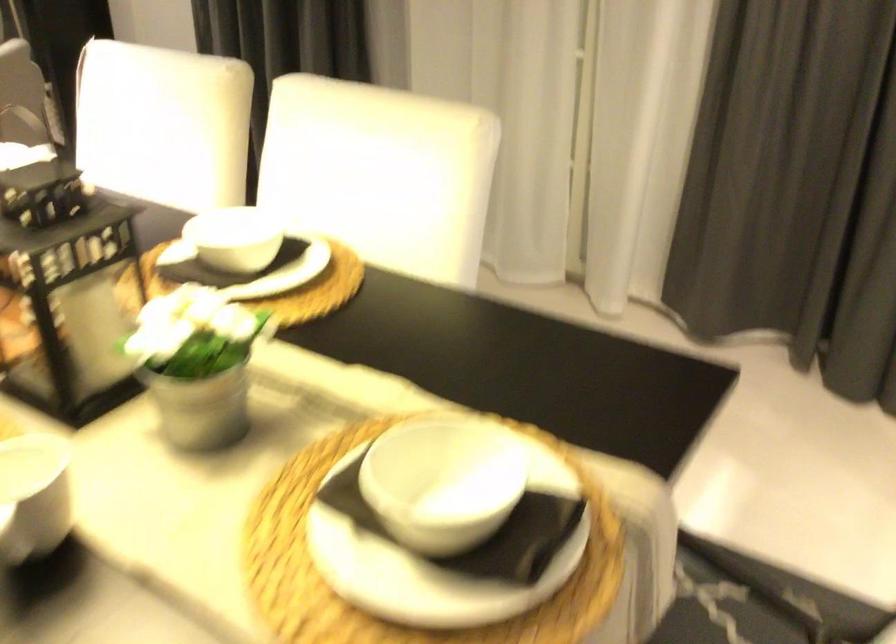
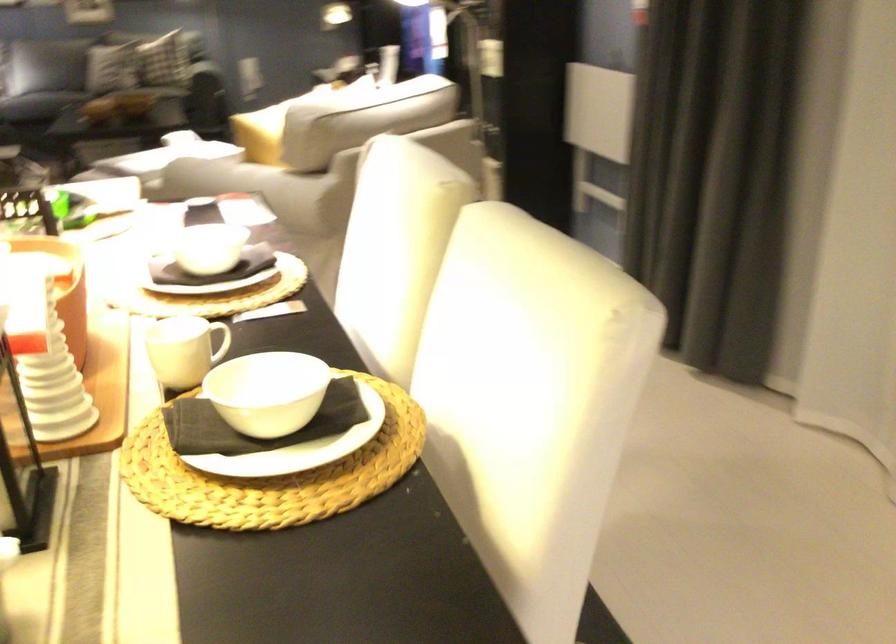
In the second image, find the point that corresponds to (x=286, y=279) in the first image.

(273, 462)